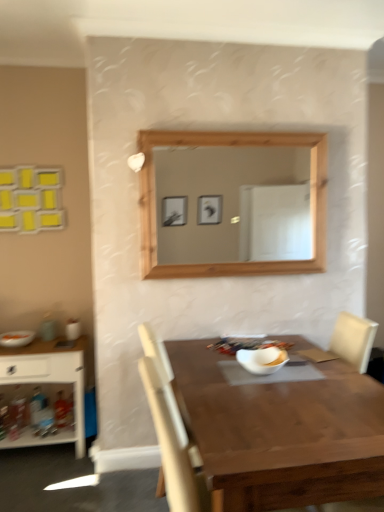
Image resolution: width=384 pixels, height=512 pixels. In order to click on free space to the left of white matte bowl at center, which appears as the second food when viewed from the back in this screenshot , I will do `click(223, 374)`.